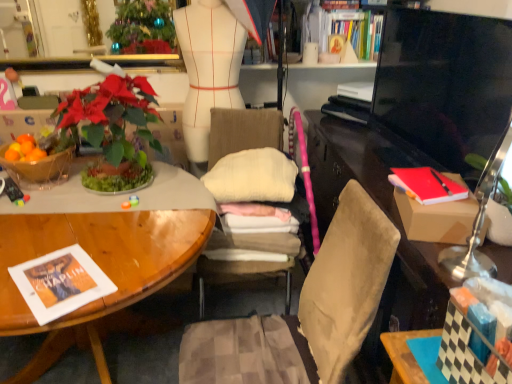
Question: Is metallic gold mirror at upper center not within matte brown desk at right?

Choices:
 (A) yes
 (B) no

Answer: (A)

Question: Does metallic gold mirror at upper center have a smaller size compared to matte brown desk at right?

Choices:
 (A) no
 (B) yes

Answer: (B)

Question: Is metallic gold mirror at upper center surrounding matte brown desk at right?

Choices:
 (A) yes
 (B) no

Answer: (B)

Question: Considering the relative sizes of metallic gold mirror at upper center and matte brown desk at right in the image provided, is metallic gold mirror at upper center shorter than matte brown desk at right?

Choices:
 (A) no
 (B) yes

Answer: (B)

Question: From the image's perspective, is metallic gold mirror at upper center above matte brown desk at right?

Choices:
 (A) no
 (B) yes

Answer: (B)

Question: From a real-world perspective, is checkered paper book at lower right, placed as the first book when sorted from bottom to top, positioned above or below metallic gold mirror at upper center?

Choices:
 (A) above
 (B) below

Answer: (B)

Question: Considering the relative positions of checkered paper book at lower right, which is counted as the 1th book, starting from the front, and metallic gold mirror at upper center in the image provided, is checkered paper book at lower right, which is counted as the 1th book, starting from the front, to the left or to the right of metallic gold mirror at upper center?

Choices:
 (A) right
 (B) left

Answer: (A)

Question: In terms of size, does checkered paper book at lower right, the 3th book in the back-to-front sequence, appear bigger or smaller than metallic gold mirror at upper center?

Choices:
 (A) big
 (B) small

Answer: (B)

Question: Is checkered paper book at lower right, which ranks as the third book in top-to-bottom order, in front of or behind metallic gold mirror at upper center in the image?

Choices:
 (A) behind
 (B) front

Answer: (B)

Question: Considering the positions of hardcover book at upper center, which appears as the second book when viewed from the front, and beige fabric chair at center in the image, is hardcover book at upper center, which appears as the second book when viewed from the front, taller or shorter than beige fabric chair at center?

Choices:
 (A) short
 (B) tall

Answer: (A)

Question: Considering their positions, is hardcover book at upper center, marked as the 1th book in a top-to-bottom arrangement, located in front of or behind beige fabric chair at center?

Choices:
 (A) front
 (B) behind

Answer: (B)

Question: From the image's perspective, is hardcover book at upper center, the third book when ordered from bottom to top, above or below beige fabric chair at center?

Choices:
 (A) below
 (B) above

Answer: (B)

Question: Do you think hardcover book at upper center, the third book when ordered from bottom to top, is within beige fabric chair at center, or outside of it?

Choices:
 (A) outside
 (B) inside

Answer: (A)

Question: From a real-world perspective, is metallic gold mirror at upper center physically located above or below black glossy television at right?

Choices:
 (A) above
 (B) below

Answer: (A)

Question: Based on their sizes in the image, would you say metallic gold mirror at upper center is bigger or smaller than black glossy television at right?

Choices:
 (A) small
 (B) big

Answer: (A)